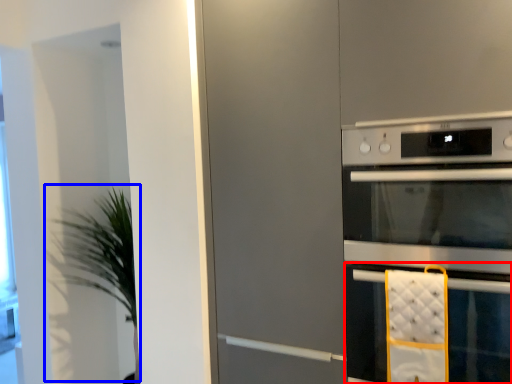
Question: Which object appears farthest to the camera in this image, oven (highlighted by a red box) or plant (highlighted by a blue box)?

Choices:
 (A) oven
 (B) plant

Answer: (B)